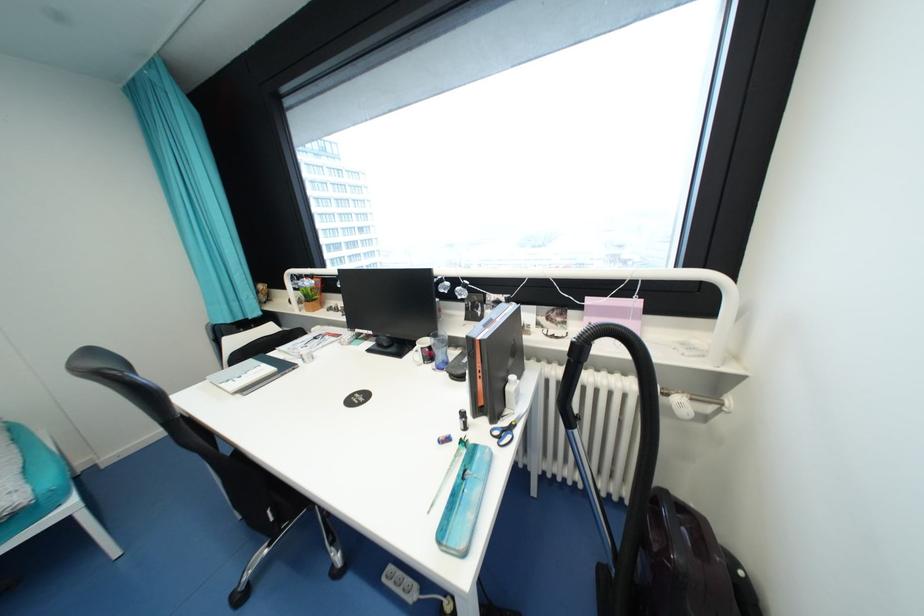
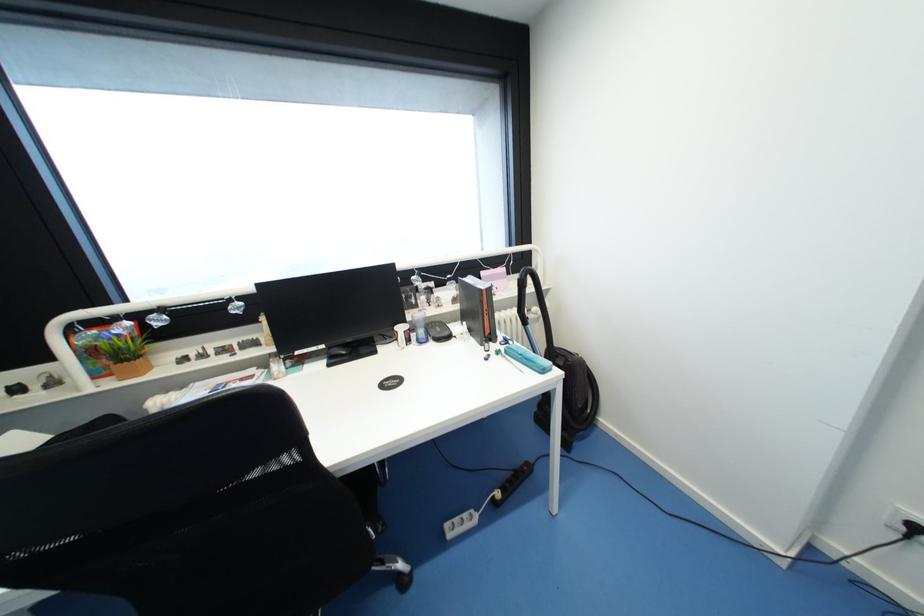
Question: The images are taken continuously from a first-person perspective. In which direction is your viewpoint rotating?

Choices:
 (A) Left
 (B) Right
 (C) Up
 (D) Down

Answer: (B)